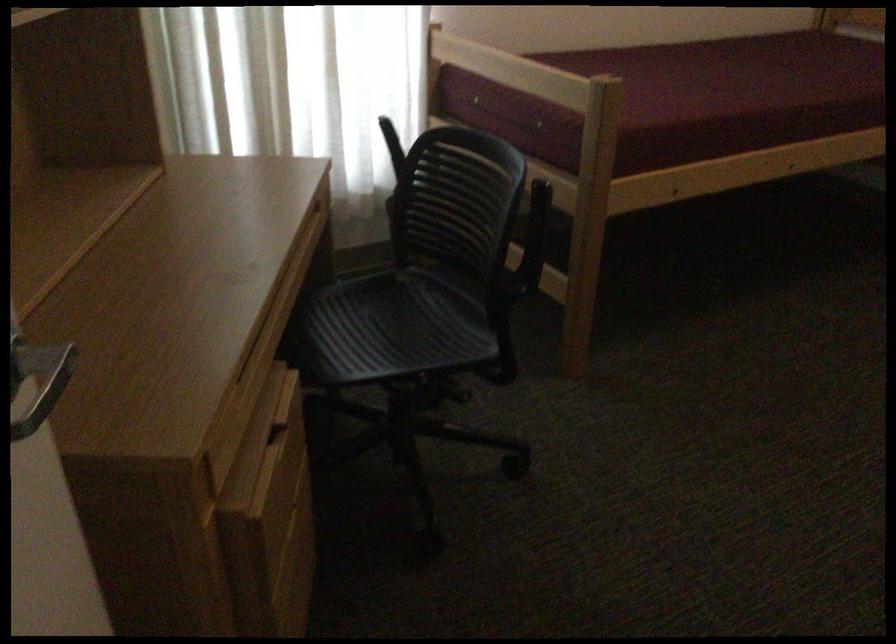
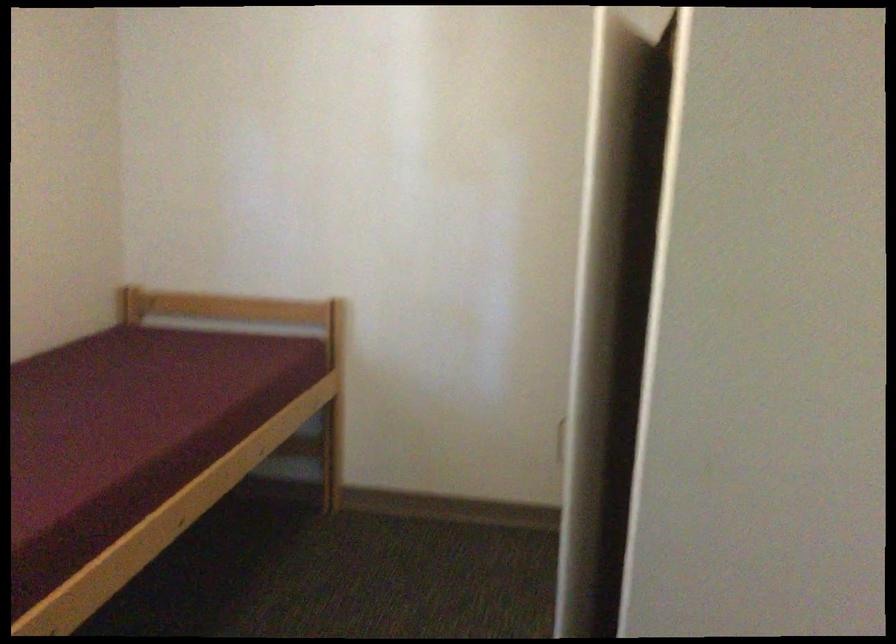
Question: The images are taken continuously from a first-person perspective. In which direction is your viewpoint rotating?

Choices:
 (A) Left
 (B) Right
 (C) Up
 (D) Down

Answer: (B)